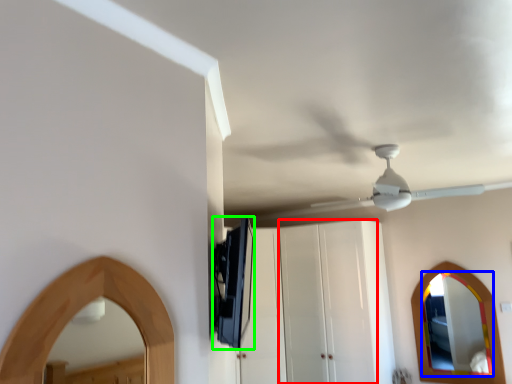
Question: Which object is positioned farthest from glass door (highlighted by a red box)? Select from mirror (highlighted by a blue box) and appliance (highlighted by a green box).

Choices:
 (A) mirror
 (B) appliance

Answer: (B)